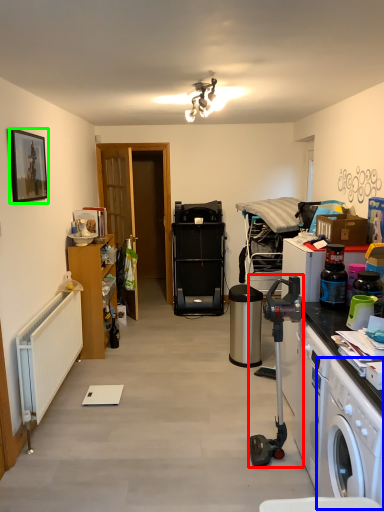
Question: Which object is positioned farthest from appliance (highlighted by a red box)? Select from washing machine (highlighted by a blue box) and picture frame (highlighted by a green box).

Choices:
 (A) washing machine
 (B) picture frame

Answer: (B)